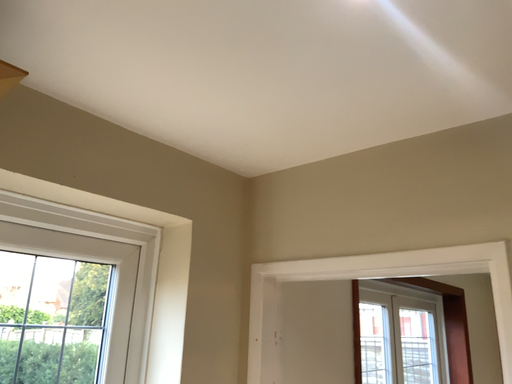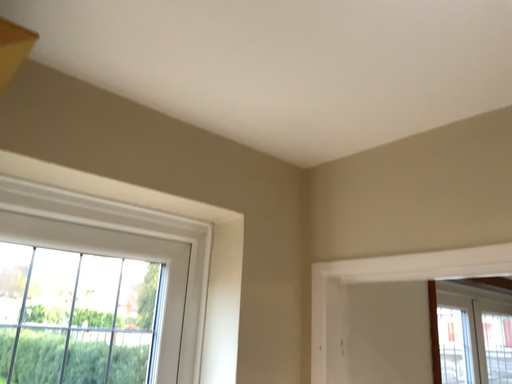
Question: How did the camera likely rotate when shooting the video?

Choices:
 (A) rotated left
 (B) rotated right

Answer: (A)